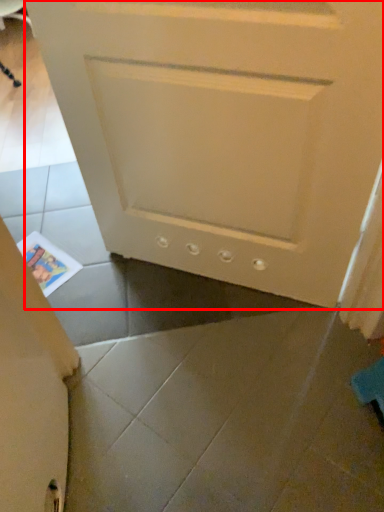
Question: From the image's perspective, where is door (annotated by the red box) located relative to magazine?

Choices:
 (A) below
 (B) above

Answer: (B)